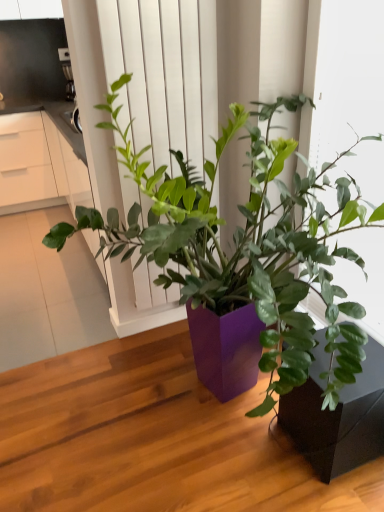
This screenshot has height=512, width=384. What do you see at coordinates (67, 73) in the screenshot? I see `brushed metal coffee maker at upper left` at bounding box center [67, 73].

What do you see at coordinates (164, 75) in the screenshot? I see `white matte screen door at center` at bounding box center [164, 75].

Locate an element on the screen. The width and height of the screenshot is (384, 512). matte black pot at lower right is located at coordinates (338, 415).

The height and width of the screenshot is (512, 384). Identify the location of purple matte planter at center. (258, 275).

At what (x,y) coordinates should I click in order to perform the action: click on appliance behind the white matte window frame at upper right. Please return your answer as a coordinate pair (x, y). The height and width of the screenshot is (512, 384). Looking at the image, I should click on (67, 73).

Could you tell me if white matte window frame at upper right is turned towards brushed metal coffee maker at upper left?

No, white matte window frame at upper right is not turned towards brushed metal coffee maker at upper left.

In the scene shown: Does white matte window frame at upper right touch brushed metal coffee maker at upper left?

No, white matte window frame at upper right is not next to brushed metal coffee maker at upper left.

Is white matte window frame at upper right surrounding brushed metal coffee maker at upper left?

No.

From the image's perspective, which is below, brushed metal coffee maker at upper left or matte black pot at lower right?

matte black pot at lower right is shown below in the image.

From a real-world perspective, who is located lower, brushed metal coffee maker at upper left or matte black pot at lower right?

From a 3D spatial view, matte black pot at lower right is below.

Is matte black pot at lower right at the back of brushed metal coffee maker at upper left?

No, brushed metal coffee maker at upper left is not facing the opposite direction of matte black pot at lower right.

Would you say brushed metal coffee maker at upper left is outside matte black pot at lower right?

Yes, brushed metal coffee maker at upper left is outside of matte black pot at lower right.

Between white matte screen door at center and purple matte planter at center, which one has smaller width?

white matte screen door at center is thinner.

From a real-world perspective, is white matte screen door at center on purple matte planter at center?

Yes, from a real-world perspective, white matte screen door at center is above purple matte planter at center.

Do you think white matte screen door at center is within purple matte planter at center, or outside of it?

The correct answer is: outside.

Considering the positions of objects white matte screen door at center and brushed metal coffee maker at upper left in the image provided, who is more to the right, white matte screen door at center or brushed metal coffee maker at upper left?

From the viewer's perspective, white matte screen door at center appears more on the right side.

What's the angular difference between white matte screen door at center and brushed metal coffee maker at upper left's facing directions?

0.000527 degrees.

Is white matte screen door at center far away from brushed metal coffee maker at upper left?

white matte screen door at center is far away from brushed metal coffee maker at upper left.

Based on their positions, is brushed metal coffee maker at upper left located to the left or right of white matte window frame at upper right?

In the image, brushed metal coffee maker at upper left appears on the left side of white matte window frame at upper right.

How many degrees apart are the facing directions of brushed metal coffee maker at upper left and white matte window frame at upper right?

90 degrees separate the facing orientations of brushed metal coffee maker at upper left and white matte window frame at upper right.

Is brushed metal coffee maker at upper left wider or thinner than white matte window frame at upper right?

In the image, brushed metal coffee maker at upper left appears to be wider than white matte window frame at upper right.

Is brushed metal coffee maker at upper left located outside white matte window frame at upper right?

Indeed, brushed metal coffee maker at upper left is completely outside white matte window frame at upper right.

Between matte black pot at lower right and white matte screen door at center, which one has smaller size?

Smaller between the two is white matte screen door at center.

What's the angular difference between matte black pot at lower right and white matte screen door at center's facing directions?

matte black pot at lower right and white matte screen door at center are facing 90 degrees away from each other.

From the picture: Is matte black pot at lower right oriented towards white matte screen door at center?

No, matte black pot at lower right is not oriented towards white matte screen door at center.

From the image's perspective, which object appears higher, matte black pot at lower right or white matte screen door at center?

white matte screen door at center, from the image's perspective.

Which is behind, point (321, 123) or point (156, 141)?

The point (156, 141) is more distant.

How different are the orientations of white matte window frame at upper right and white matte screen door at center in degrees?

There is a 90-degree angle between the facing directions of white matte window frame at upper right and white matte screen door at center.

Is white matte window frame at upper right taller than white matte screen door at center?

No.

Between white matte window frame at upper right and white matte screen door at center, which one has smaller size?

With smaller size is white matte screen door at center.

I want to click on appliance that is above the white matte window frame at upper right (from a real-world perspective), so click(67, 73).

This screenshot has width=384, height=512. I want to click on appliance on the left of matte black pot at lower right, so click(x=67, y=73).

Estimate the real-world distances between objects in this image. Which object is closer to brushed metal coffee maker at upper left, white matte window frame at upper right or matte black pot at lower right?

white matte window frame at upper right is positioned closer to the anchor brushed metal coffee maker at upper left.

Based on their spatial positions, is matte black pot at lower right or white matte screen door at center further from brushed metal coffee maker at upper left?

Based on the image, matte black pot at lower right appears to be further to brushed metal coffee maker at upper left.

Looking at the image, which one is located closer to purple matte planter at center, brushed metal coffee maker at upper left or matte black pot at lower right?

Based on the image, matte black pot at lower right appears to be nearer to purple matte planter at center.

Looking at the image, which one is located further to matte black pot at lower right, white matte screen door at center or brushed metal coffee maker at upper left?

brushed metal coffee maker at upper left lies further to matte black pot at lower right than the other object.

When comparing their distances from matte black pot at lower right, does purple matte planter at center or brushed metal coffee maker at upper left seem further?

The object further to matte black pot at lower right is brushed metal coffee maker at upper left.

Looking at the image, which one is located further to purple matte planter at center, white matte window frame at upper right or matte black pot at lower right?

Among the two, white matte window frame at upper right is located further to purple matte planter at center.

From the image, which object appears to be nearer to white matte screen door at center, matte black pot at lower right or purple matte planter at center?

Based on the image, purple matte planter at center appears to be nearer to white matte screen door at center.

Which object lies nearer to the anchor point white matte window frame at upper right, brushed metal coffee maker at upper left or matte black pot at lower right?

matte black pot at lower right.

Identify the location of window frame between purple matte planter at center and white matte screen door at center in the front-back direction. Image resolution: width=384 pixels, height=512 pixels. (342, 76).

The width and height of the screenshot is (384, 512). Find the location of `screen door positioned between matte black pot at lower right and brushed metal coffee maker at upper left from near to far`. screen door positioned between matte black pot at lower right and brushed metal coffee maker at upper left from near to far is located at coordinates (164, 75).

Where is `screen door between white matte window frame at upper right and matte black pot at lower right vertically`? This screenshot has height=512, width=384. screen door between white matte window frame at upper right and matte black pot at lower right vertically is located at coordinates click(164, 75).

Where is `flowerpot between purple matte planter at center and white matte screen door at center in the front-back direction`? flowerpot between purple matte planter at center and white matte screen door at center in the front-back direction is located at coordinates (338, 415).